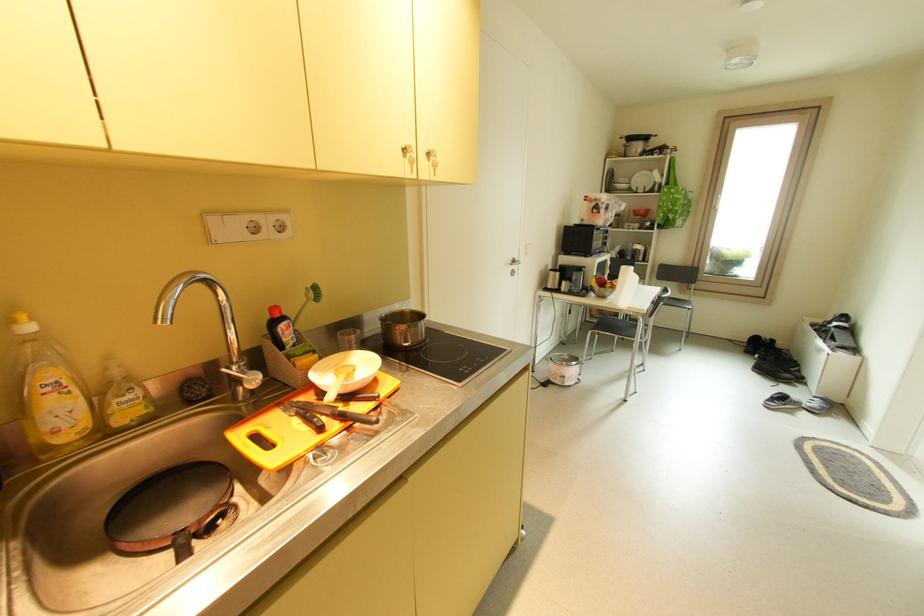
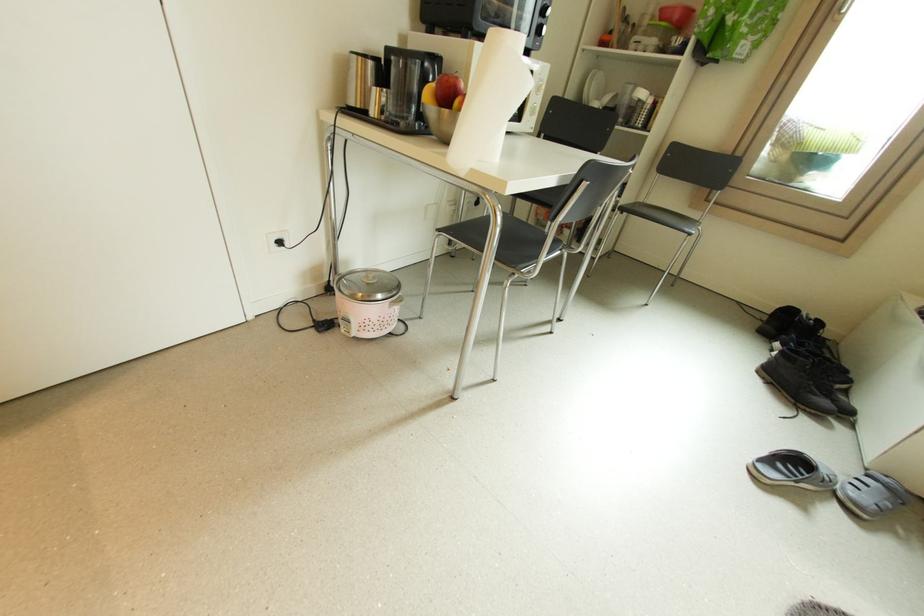
The point at (554, 286) is marked in the first image. Where is the corresponding point in the second image?

(358, 103)